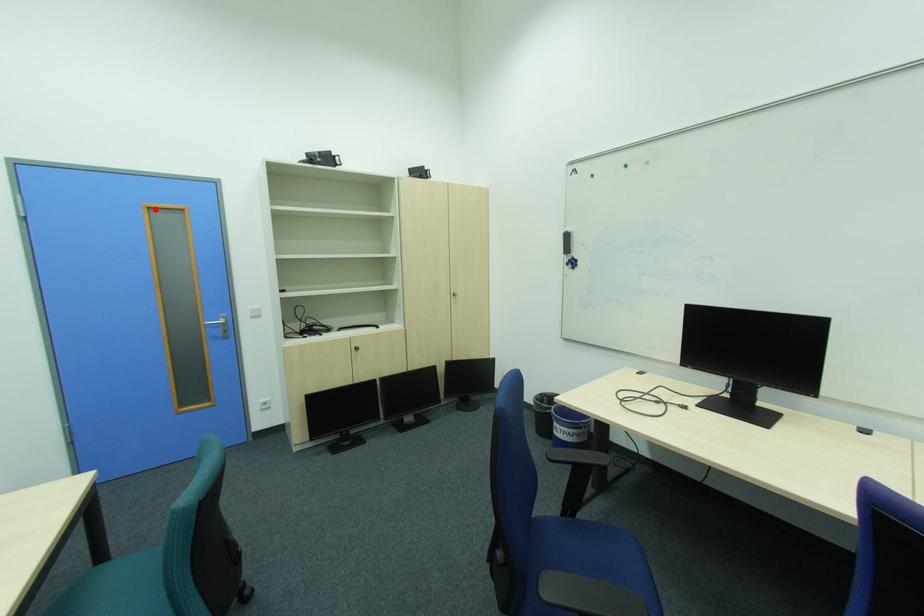
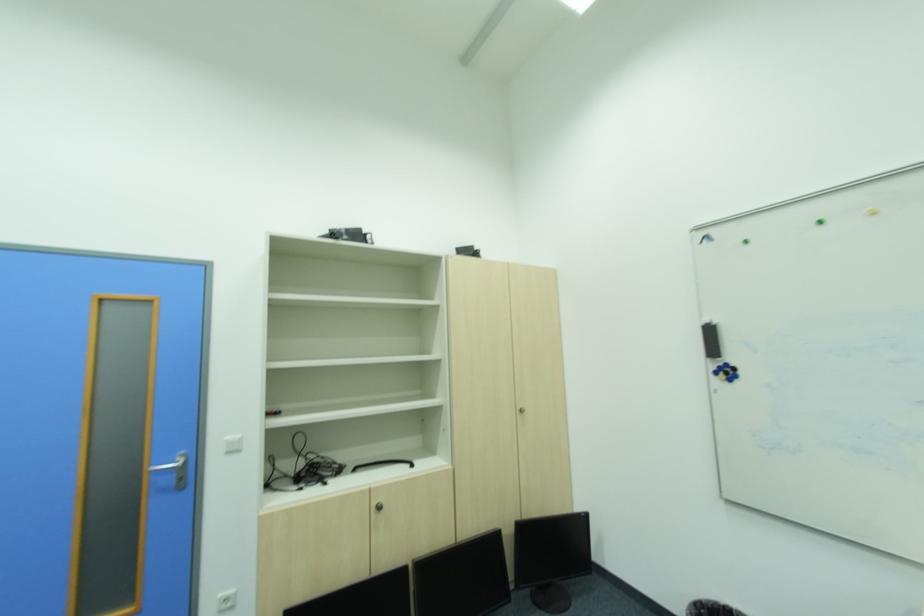
Question: I am providing you with two images of the same scene from different viewpoints. A red point is marked on the first image. At the location where the point appears in image 1, is it still visible in image 2?

Choices:
 (A) Yes
 (B) No

Answer: (A)